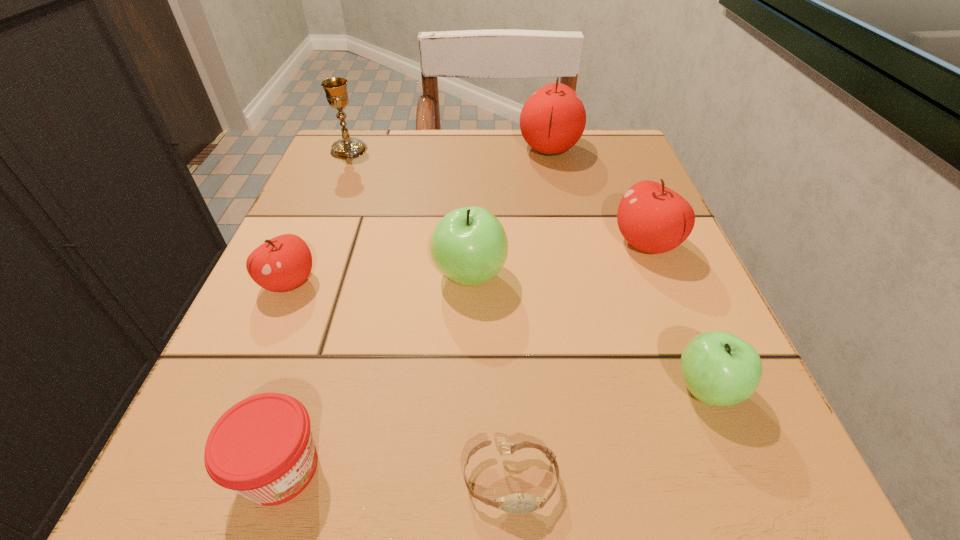
Image resolution: width=960 pixels, height=540 pixels. I want to click on apple that stands as the closest to the leftmost apple, so click(469, 245).

Select which red apple is the second closest to the leftmost apple. Please provide its 2D coordinates. Your answer should be formatted as a tuple, i.e. [(x, y)], where the tuple contains the x and y coordinates of a point satisfying the conditions above.

[(654, 219)]

Locate which red apple is the closest to the sixth object from left to right. Please provide its 2D coordinates. Your answer should be formatted as a tuple, i.e. [(x, y)], where the tuple contains the x and y coordinates of a point satisfying the conditions above.

[(654, 219)]

Identify the location of vacant position in the image that satisfies the following two spatial constraints: 1. on the back side of the second apple from left to right; 2. on the right side of the rightmost red apple. (470, 244).

Where is `vacant position in the image that satisfies the following two spatial constraints: 1. on the front side of the left green apple; 2. on the label side of the red jam`? The image size is (960, 540). vacant position in the image that satisfies the following two spatial constraints: 1. on the front side of the left green apple; 2. on the label side of the red jam is located at coordinates (466, 468).

Locate an element on the screen. vacant area in the image that satisfies the following two spatial constraints: 1. on the front side of the chalice; 2. on the left side of the rightmost red apple is located at coordinates (310, 244).